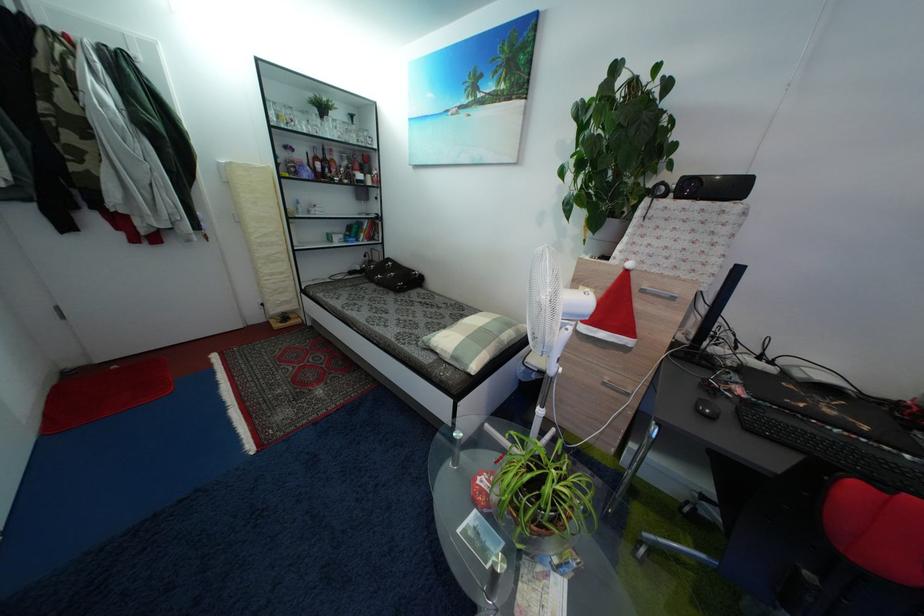
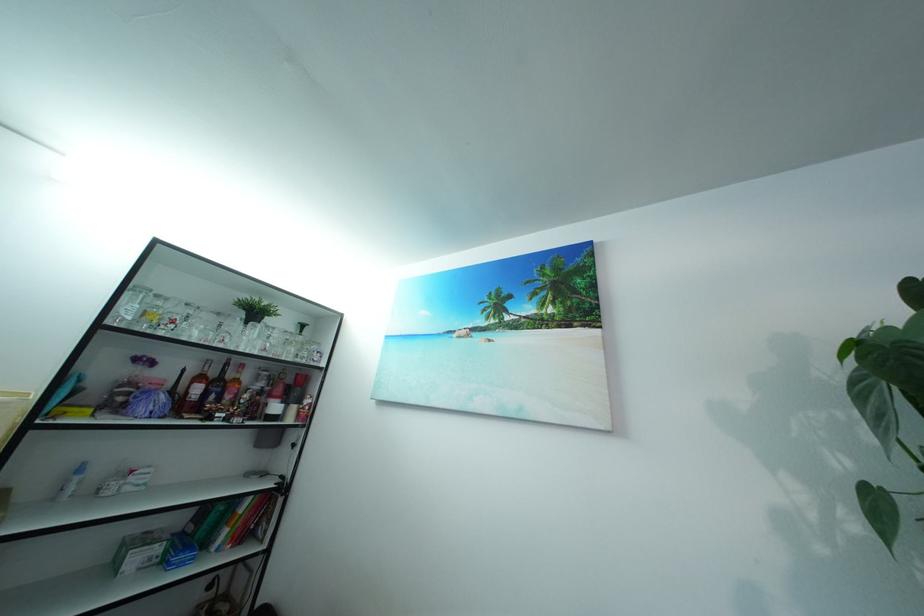
Where in the second image is the point corresponding to (x=357, y=175) from the first image?

(269, 400)